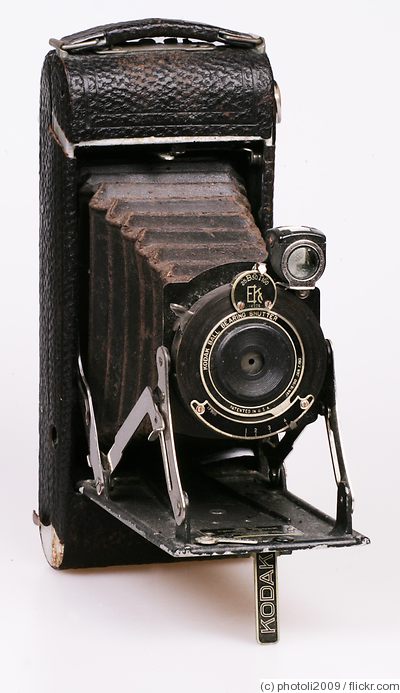
Locate an element on the screen. This screenshot has height=693, width=400. glass is located at coordinates (300, 265).